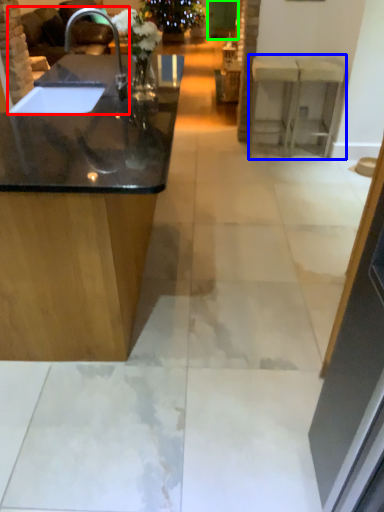
Question: Which object is the farthest from sink (highlighted by a red box)? Choose among these: counter (highlighted by a blue box) or glass door (highlighted by a green box).

Choices:
 (A) counter
 (B) glass door

Answer: (B)